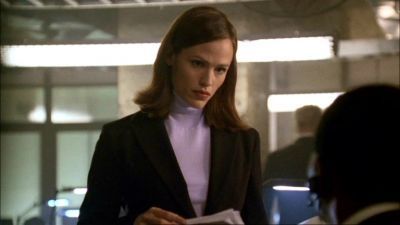
What are the coordinates of `office` in the screenshot? It's located at (254, 83).